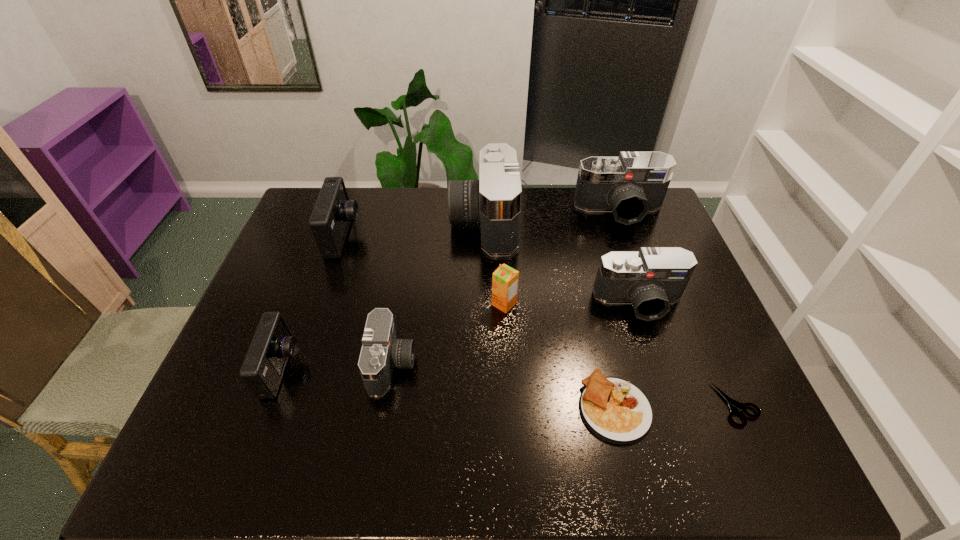
What are the coordinates of `the second black camera from left to right` in the screenshot? It's located at (494, 201).

Locate an element on the screen. This screenshot has height=540, width=960. the tallest object is located at coordinates (494, 201).

Identify the location of the third smallest black camera. (634, 183).

This screenshot has height=540, width=960. Identify the location of the bigger blue camera. (330, 219).

Locate an element on the screen. Image resolution: width=960 pixels, height=540 pixels. the third nearest camera is located at coordinates (651, 279).

Identify the location of the second smallest black camera. Image resolution: width=960 pixels, height=540 pixels. (651, 279).

The image size is (960, 540). What are the coordinates of `orange juice` in the screenshot? It's located at [505, 279].

In order to click on the smaller blue camera in this screenshot , I will do `click(273, 343)`.

I want to click on the leftmost black camera, so click(x=381, y=352).

You are a GUI agent. You are given a task and a screenshot of the screen. Output one action in this format:
    pyautogui.click(x=<x>, y=<y>)
    Task: Click on the nearest black camera
    Image resolution: width=960 pixels, height=540 pixels.
    Given the screenshot: What is the action you would take?
    pyautogui.click(x=381, y=352)